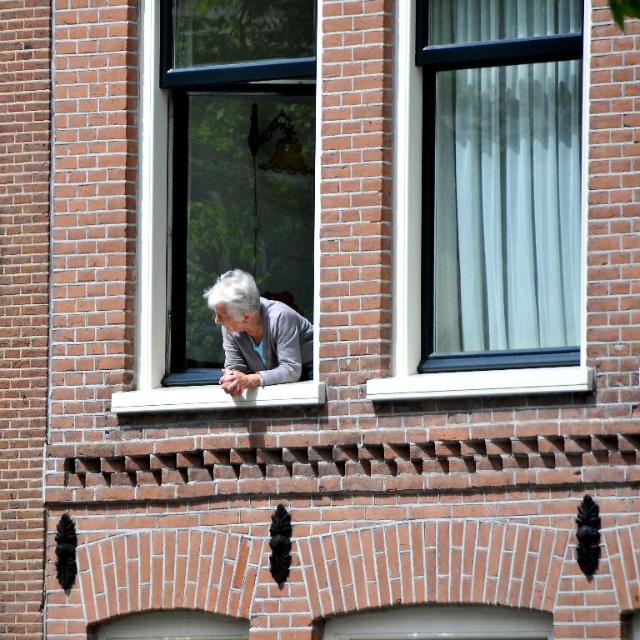
You are a delivery person standing outside the brick building. You need to hand a package to the elderly person leaning out of the window. Which object is closer to you, the clear glass window at center or the gray matte sweater at center?

The clear glass window at center is closer to you than the gray matte sweater at center because the window is above the sweater, meaning the sweater is behind the window from your perspective.

You are a window installer assessing the exterior of a brick building. You need to replace the clear glass window at center and the gray matte sweater at center. Which object requires a wider replacement material?

The clear glass window at center requires wider replacement material since its width is larger than the gray matte sweater at center.

You are standing in front of the brick building and looking at the window. There are two points marked on the window. Which of the two points, point (x=164, y=145) or point (x=195, y=401), is closer to you?

Point (x=164, y=145) is closer to you because it is further to the viewer than point (x=195, y=401).